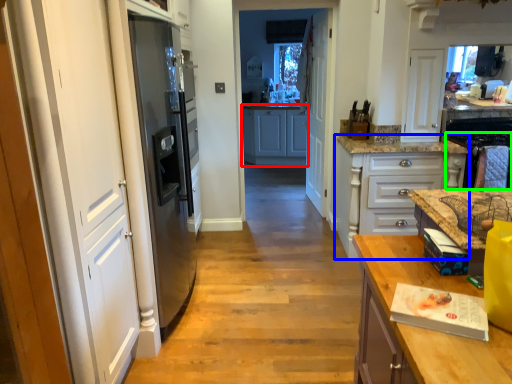
Question: Which object is positioned closest to cabinetry (highlighted by a red box)? Select from cabinetry (highlighted by a blue box) and oven (highlighted by a green box).

Choices:
 (A) cabinetry
 (B) oven

Answer: (A)